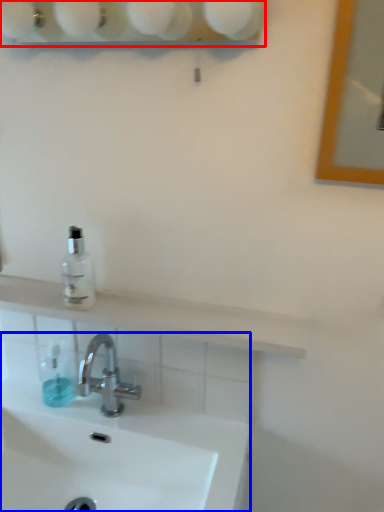
Question: Which of the following is the farthest to the observer, shelf (highlighted by a red box) or sink (highlighted by a blue box)?

Choices:
 (A) shelf
 (B) sink

Answer: (B)